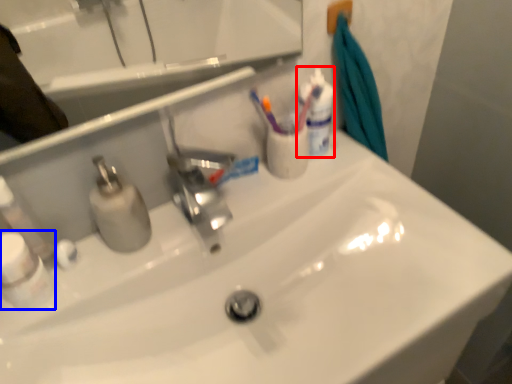
Question: Which of the following is the closest to the observer, mouthwash (highlighted by a red box) or mouthwash (highlighted by a blue box)?

Choices:
 (A) mouthwash
 (B) mouthwash

Answer: (B)